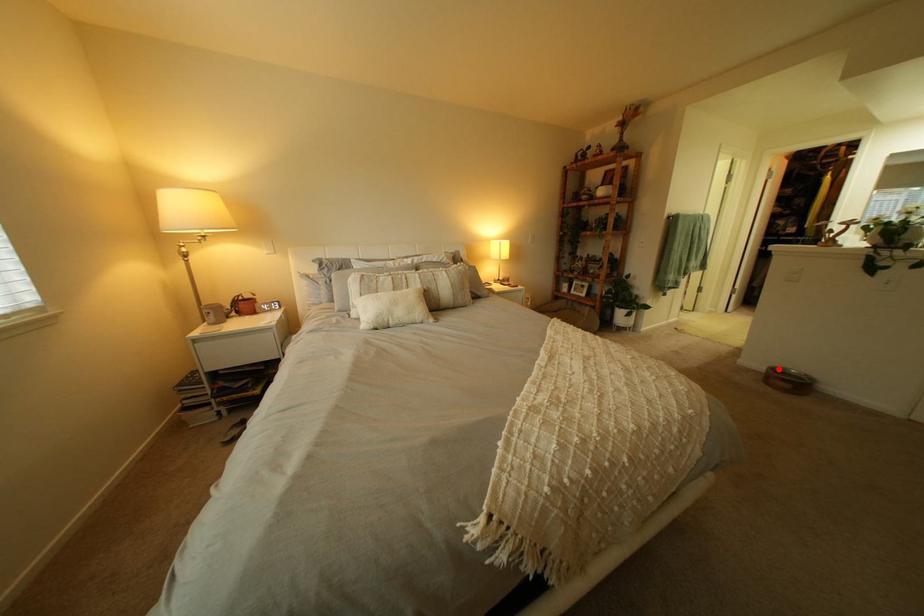
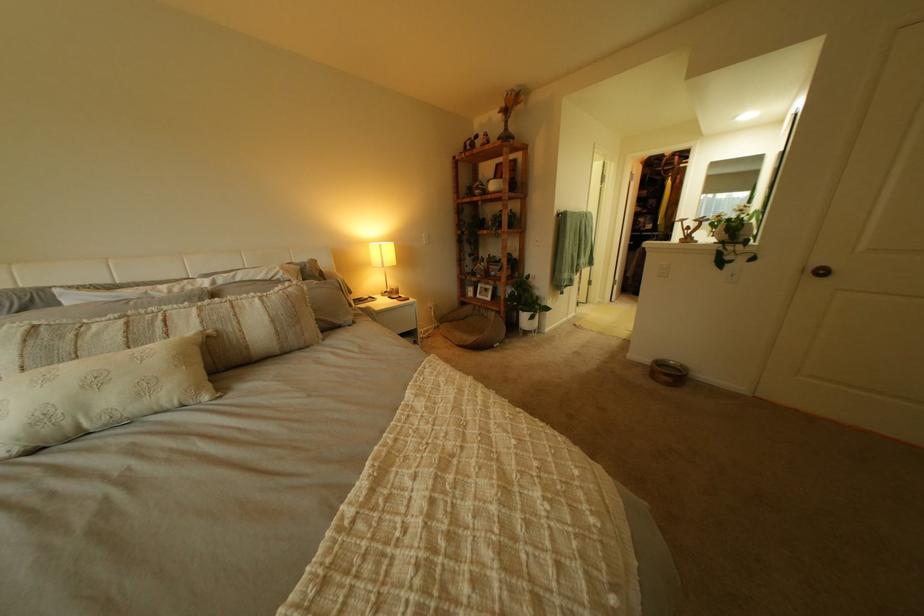
The point at the highlighted location is marked in the first image. Where is the corresponding point in the second image?

(663, 362)